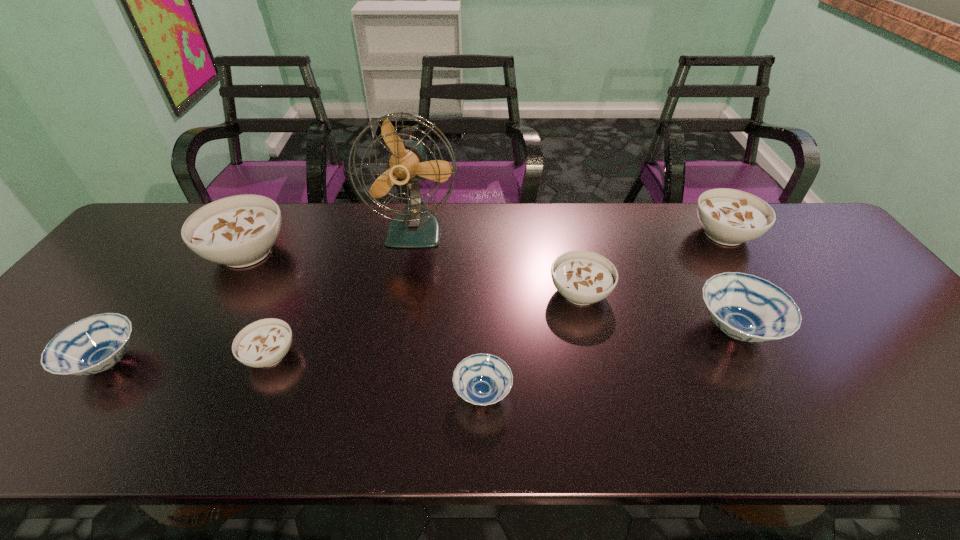
The image size is (960, 540). I want to click on vacant region located on the back of the fourth object from right to left, so click(482, 257).

Locate an element on the screen. This screenshot has height=540, width=960. fan located in the far edge section of the desktop is located at coordinates (416, 227).

This screenshot has width=960, height=540. Find the location of `object at the near edge`. object at the near edge is located at coordinates (482, 379).

Locate an element on the screen. object at the left edge is located at coordinates (94, 344).

Where is `free region at the far edge`? The image size is (960, 540). free region at the far edge is located at coordinates (689, 233).

In order to click on vacant area at the near edge in this screenshot , I will do `click(414, 442)`.

This screenshot has width=960, height=540. In the image, there is a desktop. Find the location of `vacant area at the right edge`. vacant area at the right edge is located at coordinates (823, 254).

Where is `vacant point located between the smallest blue soup bowl and the tallest object`? vacant point located between the smallest blue soup bowl and the tallest object is located at coordinates click(449, 312).

Locate an element on the screen. This screenshot has width=960, height=540. vacant space that is in between the second white soup bowl from right to left and the fourth object from left to right is located at coordinates (497, 262).

Locate an element on the screen. unoccupied position between the rightmost white soup bowl and the biggest white soup bowl is located at coordinates (486, 243).